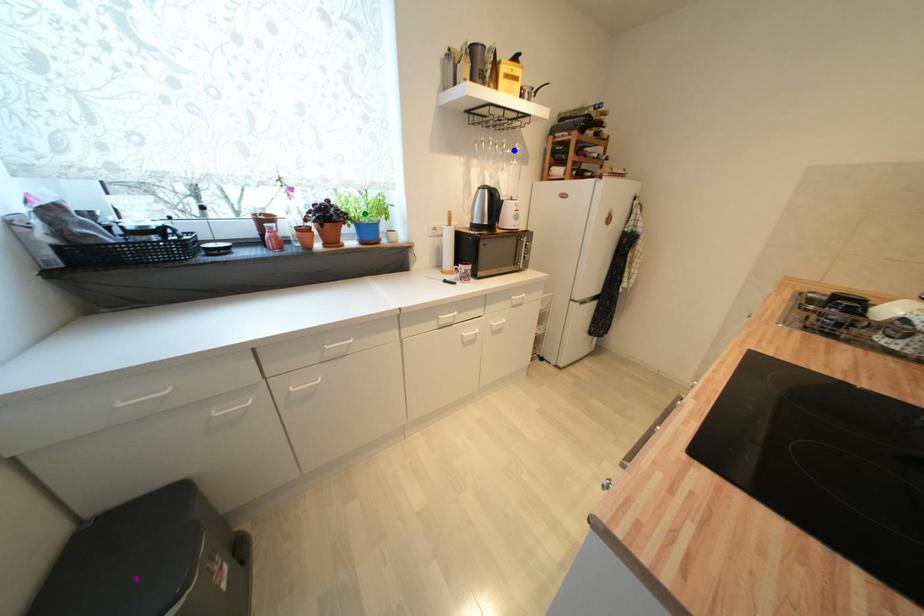
Order these from nearest to farthest:
green point | purple point | blue point

blue point
green point
purple point